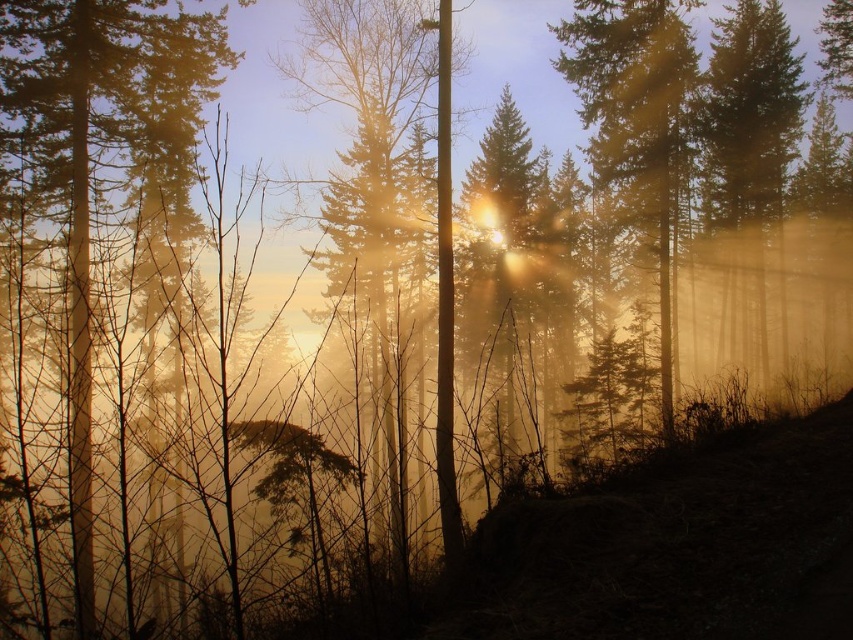
Based on the photo, can you confirm if smooth brown tree trunk at left is thinner than green matte tree at upper right?

No.

Does smooth brown tree trunk at left appear over green matte tree at upper right?

No.

This screenshot has height=640, width=853. I want to click on smooth brown tree trunk at left, so click(x=90, y=156).

Measure the distance between silvery metallic tree at center and green matte tree at upper right.

silvery metallic tree at center and green matte tree at upper right are 27.72 meters apart from each other.

Which is below, silvery metallic tree at center or green matte tree at upper right?

silvery metallic tree at center is lower down.

Is point (387, 438) positioned behind point (614, 136)?

No, it is in front of (614, 136).

This screenshot has height=640, width=853. I want to click on silvery metallic tree at center, so click(x=393, y=205).

The image size is (853, 640). What do you see at coordinates (747, 156) in the screenshot?
I see `smooth golden tree at right` at bounding box center [747, 156].

Between point (776, 216) and point (637, 36), which one is positioned in front?

Positioned in front is point (637, 36).

The height and width of the screenshot is (640, 853). Identify the location of smooth golden tree at right. (747, 156).